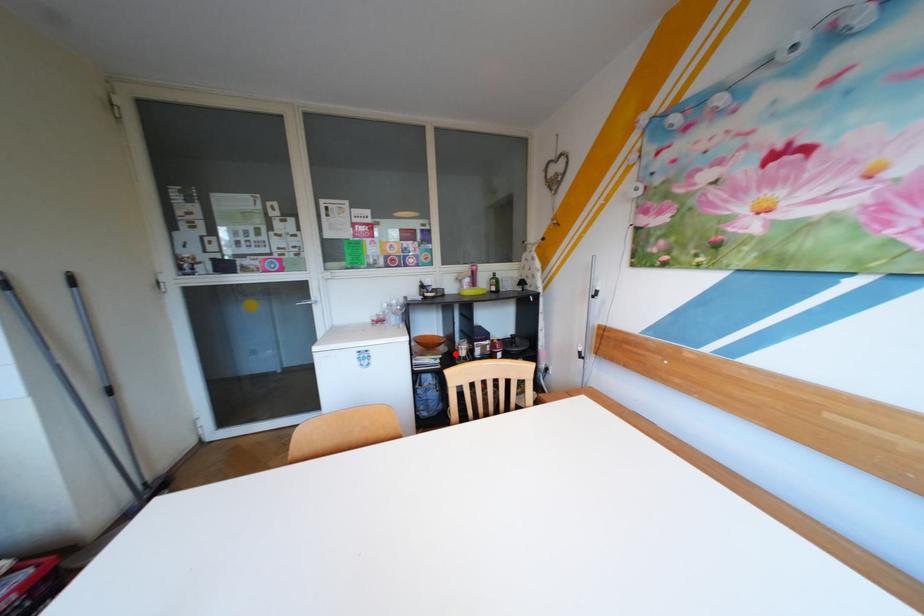
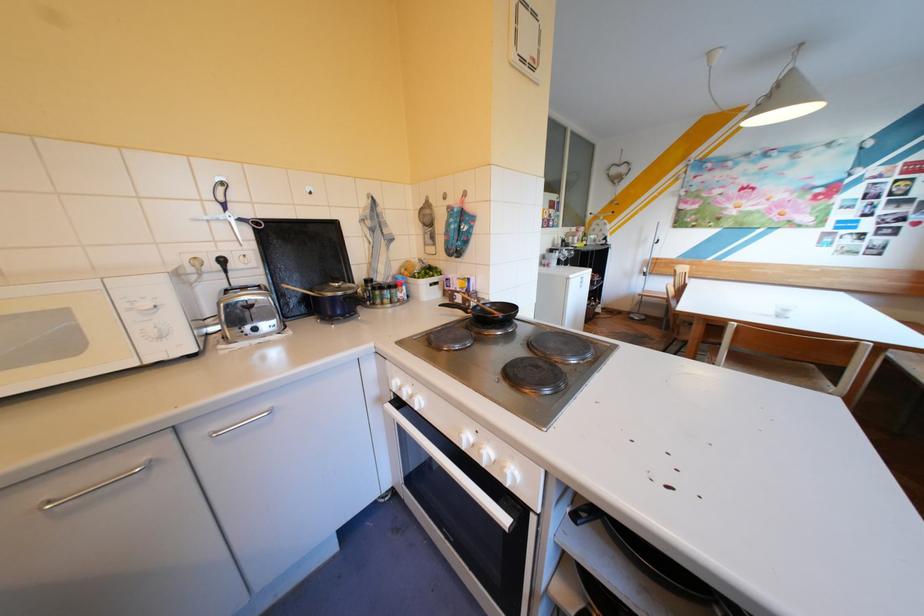
Question: I am providing you with two images of the same scene from different viewpoints. A red point is marked on the first image. Can you still see the location of the red point in image 2?

Choices:
 (A) Yes
 (B) No

Answer: (B)